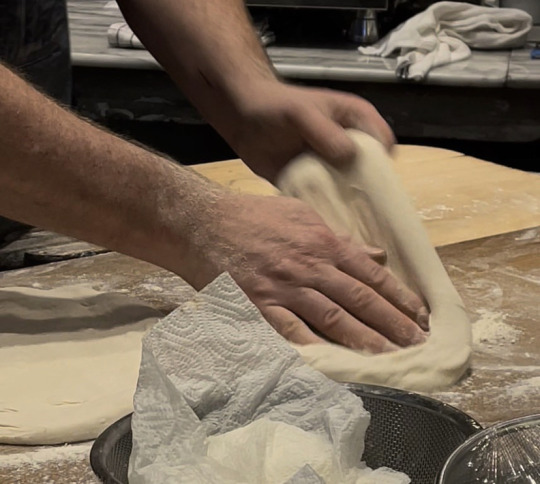
The height and width of the screenshot is (484, 540). In order to click on paper towel in this screenshot , I will do `click(227, 374)`.